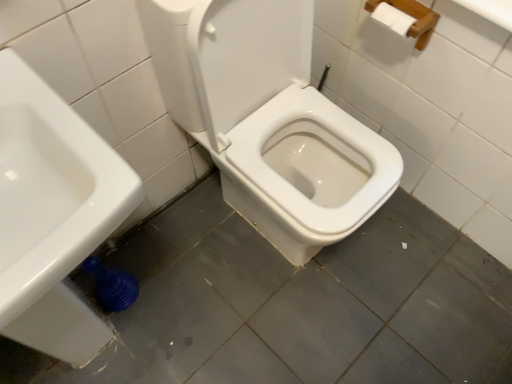
This screenshot has width=512, height=384. What do you see at coordinates (268, 119) in the screenshot?
I see `white glossy toilet at center` at bounding box center [268, 119].

Where is `white glossy toilet at center`? white glossy toilet at center is located at coordinates (268, 119).

What do you see at coordinates (51, 188) in the screenshot? This screenshot has width=512, height=384. I see `white glossy sink at lower left` at bounding box center [51, 188].

At what (x,y) coordinates should I click in order to perform the action: click on white glossy sink at lower left. Please return your answer as a coordinate pair (x, y). Looking at the image, I should click on (51, 188).

In order to face white glossy sink at lower left, should I rotate leftwards or rightwards?

To face it directly, rotate left by 28.551 degrees.

Locate an element on the screen. This screenshot has width=512, height=384. white glossy toilet at center is located at coordinates 268,119.

Can you confirm if white glossy toilet at center is positioned to the right of white glossy sink at lower left?

Indeed, white glossy toilet at center is positioned on the right side of white glossy sink at lower left.

Is white glossy toilet at center further to camera compared to white glossy sink at lower left?

Yes.

Does point (277, 223) come closer to viewer compared to point (61, 118)?

No, (277, 223) is further to viewer.

From the image's perspective, which is below, white glossy toilet at center or white glossy sink at lower left?

white glossy sink at lower left.

From a real-world perspective, who is located lower, white glossy toilet at center or white glossy sink at lower left?

From a 3D spatial view, white glossy toilet at center is below.

In terms of width, does white glossy toilet at center look wider or thinner when compared to white glossy sink at lower left?

white glossy toilet at center is wider than white glossy sink at lower left.

Is white glossy toilet at center shorter than white glossy sink at lower left?

Yes.

Considering the relative sizes of white glossy toilet at center and white glossy sink at lower left in the image provided, is white glossy toilet at center bigger than white glossy sink at lower left?

No.

Does white glossy toilet at center contain white glossy sink at lower left?

No, white glossy sink at lower left is located outside of white glossy toilet at center.

Are white glossy toilet at center and white glossy sink at lower left far apart?

That's not correct — white glossy toilet at center is a little close to white glossy sink at lower left.

Is white glossy toilet at center facing away from white glossy sink at lower left?

No.

Looking at this image, how many degrees apart are the facing directions of white glossy toilet at center and white glossy sink at lower left?

They differ by 1.31 degrees in their facing directions.

In the image, there is a white glossy toilet at center. Identify the location of sink below it (from the image's perspective). (51, 188).

Considering the relative positions of white glossy sink at lower left and white glossy toilet at center in the image provided, is white glossy sink at lower left to the right of white glossy toilet at center from the viewer's perspective?

Incorrect, white glossy sink at lower left is not on the right side of white glossy toilet at center.

Considering their positions, is white glossy sink at lower left located in front of or behind white glossy toilet at center?

Clearly, white glossy sink at lower left is in front of white glossy toilet at center.

Does point (7, 187) appear closer or farther from the camera than point (271, 35)?

Point (7, 187) appears to be closer to the viewer than point (271, 35).

From the image's perspective, is white glossy sink at lower left under white glossy toilet at center?

Indeed, from the image's perspective, white glossy sink at lower left is shown beneath white glossy toilet at center.

Looking at this image, from a real-world perspective, is white glossy sink at lower left physically below white glossy toilet at center?

No, from a real-world perspective, white glossy sink at lower left is not below white glossy toilet at center.

Considering the relative sizes of white glossy sink at lower left and white glossy toilet at center in the image provided, is white glossy sink at lower left wider than white glossy toilet at center?

In fact, white glossy sink at lower left might be narrower than white glossy toilet at center.

Based on the photo, does white glossy sink at lower left have a greater height compared to white glossy toilet at center?

Correct, white glossy sink at lower left is much taller as white glossy toilet at center.

From the picture: Is white glossy sink at lower left smaller than white glossy toilet at center?

Incorrect, white glossy sink at lower left is not smaller in size than white glossy toilet at center.

Would you say white glossy sink at lower left is inside or outside white glossy toilet at center?

white glossy sink at lower left exists outside the volume of white glossy toilet at center.

Is white glossy sink at lower left with white glossy toilet at center?

No, white glossy sink at lower left is not with white glossy toilet at center.

Is white glossy sink at lower left aimed at white glossy toilet at center?

No, white glossy sink at lower left is not turned towards white glossy toilet at center.

What's the angular difference between white glossy sink at lower left and white glossy toilet at center's facing directions?

They differ by 1.31 degrees in their facing directions.

This screenshot has width=512, height=384. I want to click on toilet behind the white glossy sink at lower left, so click(268, 119).

Where is `sink on the left side of white glossy toilet at center`? The image size is (512, 384). sink on the left side of white glossy toilet at center is located at coordinates (51, 188).

At what (x,y) coordinates should I click in order to perform the action: click on sink above the white glossy toilet at center (from a real-world perspective). Please return your answer as a coordinate pair (x, y). The image size is (512, 384). Looking at the image, I should click on (51, 188).